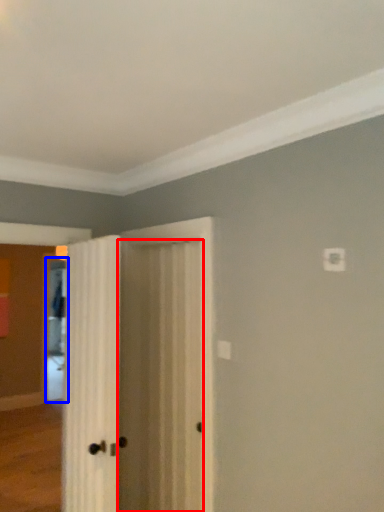
Question: Which of the following is the closest to the observer, door (highlighted by a red box) or screen door (highlighted by a blue box)?

Choices:
 (A) door
 (B) screen door

Answer: (A)